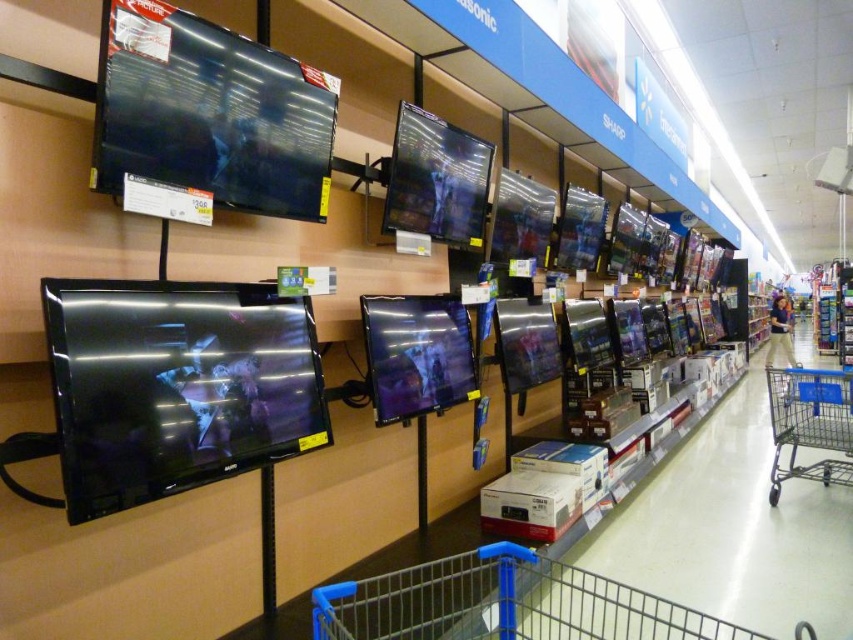
Between blue metal shopping cart at lower center and beige cotton pants at lower right, which one appears on the right side from the viewer's perspective?

Positioned to the right is beige cotton pants at lower right.

Between blue metal shopping cart at lower center and beige cotton pants at lower right, which one has more height?

blue metal shopping cart at lower center is taller.

Locate an element on the screen. The height and width of the screenshot is (640, 853). blue metal shopping cart at lower center is located at coordinates (503, 604).

Based on the photo, can you confirm if blue metal shopping cart at lower center is smaller than metallic gray shopping cart at lower right?

No, blue metal shopping cart at lower center is not smaller than metallic gray shopping cart at lower right.

Is blue metal shopping cart at lower center positioned in front of metallic gray shopping cart at lower right?

That is True.

This screenshot has width=853, height=640. What do you see at coordinates (503, 604) in the screenshot? I see `blue metal shopping cart at lower center` at bounding box center [503, 604].

This screenshot has width=853, height=640. Identify the location of blue metal shopping cart at lower center. (503, 604).

Can you confirm if metallic gray shopping cart at lower right is shorter than beige cotton pants at lower right?

No.

Is point (784, 436) in front of point (780, 324)?

Yes, point (784, 436) is closer to viewer.

Where is `metallic gray shopping cart at lower right`? The height and width of the screenshot is (640, 853). metallic gray shopping cart at lower right is located at coordinates (810, 422).